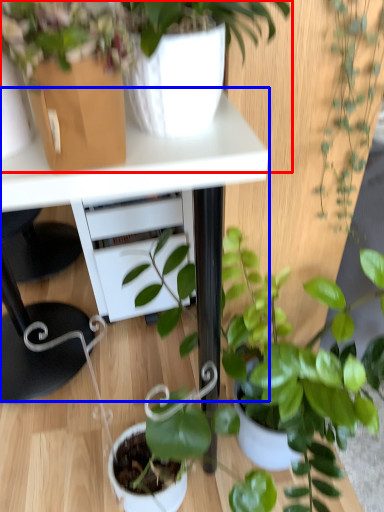
Question: Among these objects, which one is nearest to the camera, houseplant (highlighted by a red box) or table (highlighted by a blue box)?

Choices:
 (A) houseplant
 (B) table

Answer: (A)